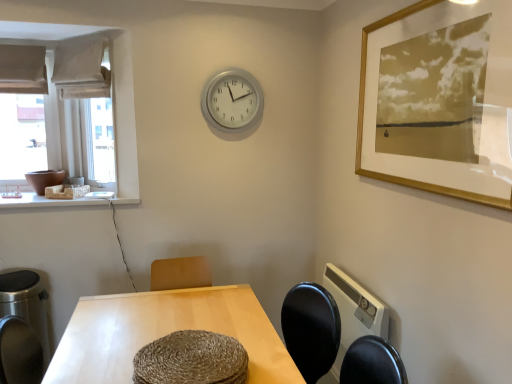
Find the location of a particular element. vacant point above white fabric curtain at upper left (from a real-world perspective) is located at coordinates (72, 39).